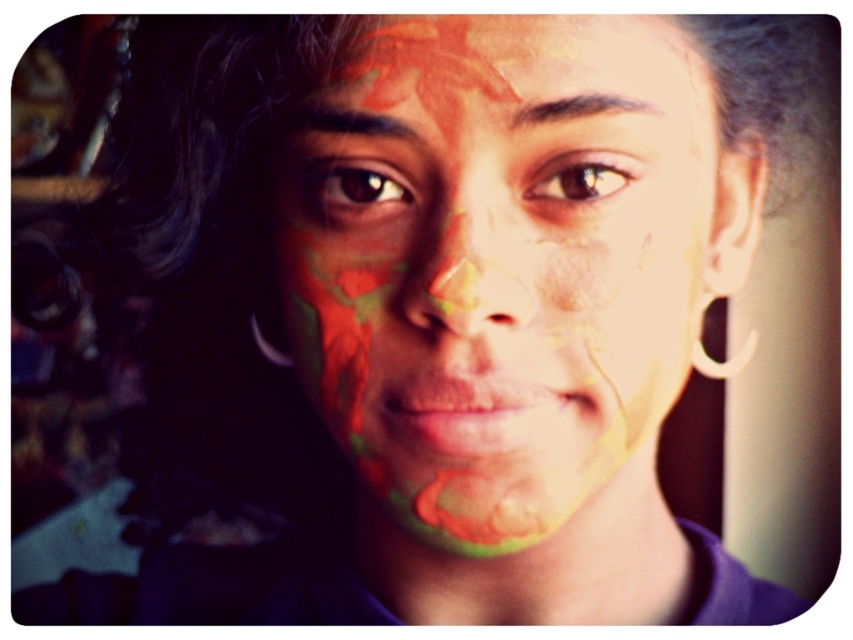
You are an artist trying to replicate this portrait. You notice the multicolored paint at center and the brown matte eye at upper center. Which object is wider in the image?

The multicolored paint at center might be wider than brown matte eye at upper center according to the description.

You are an artist analyzing the portrait and want to locate the brown matte eye at center. According to the coordinates provided, where exactly is it positioned in the image?

The brown matte eye at center is located at the coordinates point (357, 188).